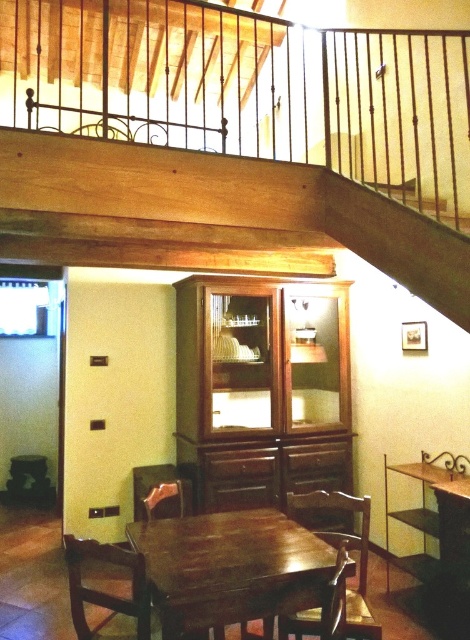
You are a painter standing in the dining area and want to hang a painting that requires a hook placed higher than the wooden chair at lower left. Can you use the wooden at upper center for this purpose?

The wooden at upper center is taller than the wooden chair at lower left, so yes, the hook can be placed on the wooden at upper center since it is taller than the wooden chair at lower left.

From the picture: You are planning to place a new decorative item in the dining area. You have two options to choose from, the wooden at upper center and the wooden chair at lower left. Which one is bigger in size?

The wooden at upper center is larger in size than the wooden chair at lower left.